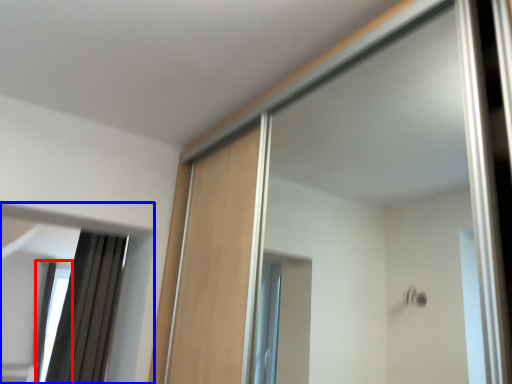
Question: Which point is further to the camera, window (highlighted by a red box) or mirror (highlighted by a blue box)?

Choices:
 (A) window
 (B) mirror

Answer: (A)